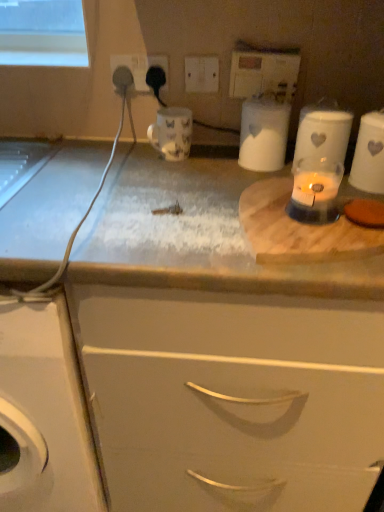
At what (x,y) coordinates should I click in order to perform the action: click on vacant space in front of matte ceramic mug at center, which is counted as the first appliance, starting from the left. Please return your answer as a coordinate pair (x, y). Looking at the image, I should click on (167, 182).